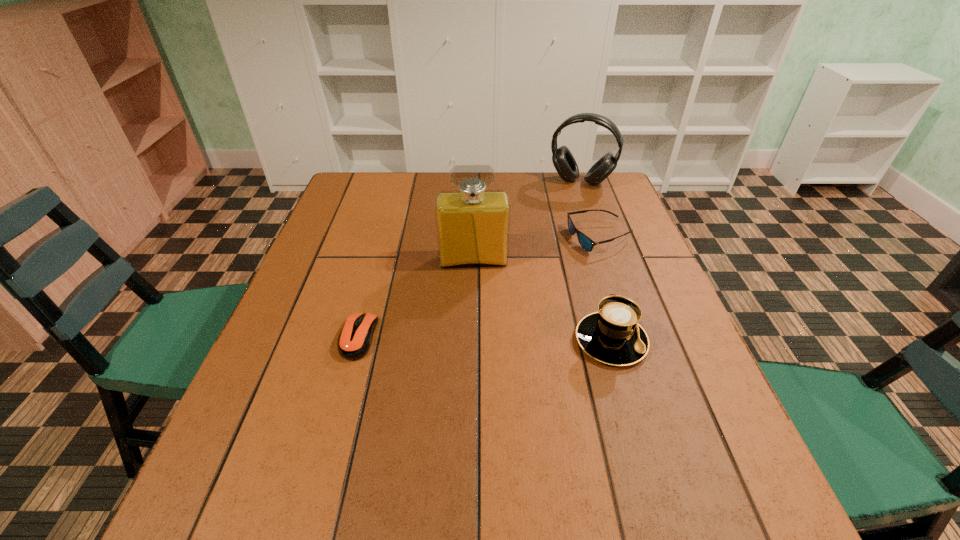
The width and height of the screenshot is (960, 540). In order to click on cappuccino at the right edge in this screenshot , I will do `click(612, 335)`.

Where is `sunglasses located at the right edge`? sunglasses located at the right edge is located at coordinates (586, 243).

Locate an element on the screen. The image size is (960, 540). headset that is at the right edge is located at coordinates (563, 160).

Where is `object that is at the far right corner`? object that is at the far right corner is located at coordinates (563, 160).

The width and height of the screenshot is (960, 540). Identify the location of vacant region at the far edge of the desktop. (543, 195).

Where is `vacant space at the near edge`? vacant space at the near edge is located at coordinates pyautogui.click(x=492, y=442).

Locate an element on the screen. vacant region at the left edge of the desktop is located at coordinates (318, 274).

The width and height of the screenshot is (960, 540). In the image, there is a desktop. What are the coordinates of `vacant space at the right edge` in the screenshot? It's located at (641, 325).

Locate an element on the screen. This screenshot has width=960, height=540. free spot at the far left corner of the desktop is located at coordinates (350, 210).

In the image, there is a desktop. What are the coordinates of `vacant space at the near right corner` in the screenshot? It's located at (708, 418).